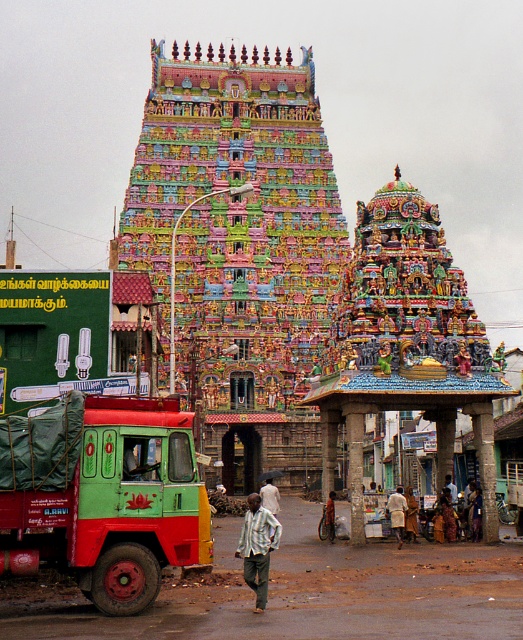
You are standing in front of the temple and want to take a photo that includes both the central gopuram and the smaller gateway. You notice a specific point at coordinates point (175, 449) which is 55.84 meters away from you. Considering this distance, will this point be in focus if your camera has a depth of field that extends up to 50 meters?

The point (175, 449) is 55.84 meters away from the camera. Since the depth of field only extends up to 50 meters, the point will be out of focus.